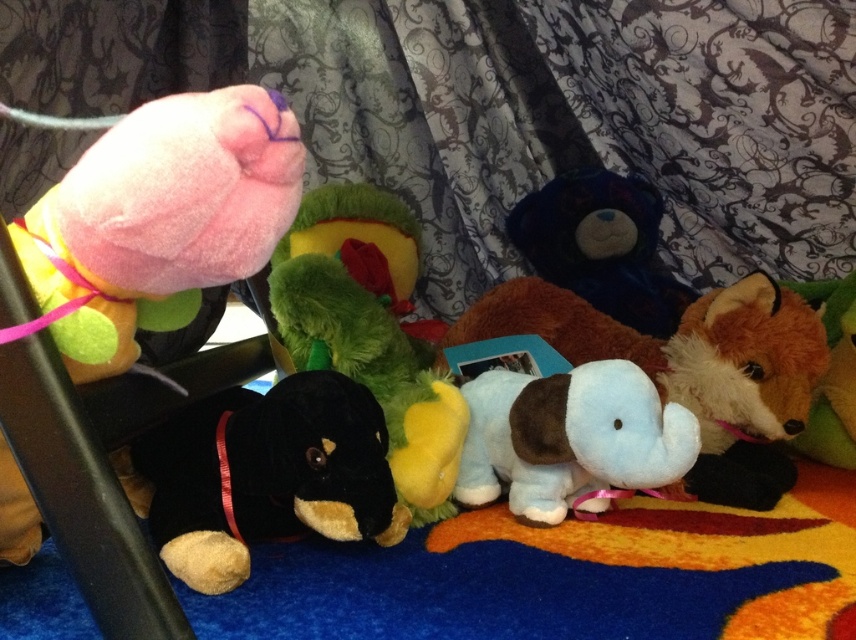
You are organizing a toy store display and need to place a new toy between the pink plush toy at left and the velvety green plush at center. The new toy is 20 centimeters wide. Is there enough space between them to fit the new toy without moving the existing ones?

The distance between the pink plush toy at left and the velvety green plush at center is 42.59 centimeters. Since the new toy is only 20 centimeters wide, there is sufficient space to place it between them without moving the existing toys.

You are a toy organizer who needs to place a new toy that is 1 meter long between the pink plush toy at left and the light blue plush dog at center. Is there enough space between them to fit the new toy?

The distance between the pink plush toy at left and the light blue plush dog at center is 70.28 centimeters. Since the new toy is 1 meter long, which is 30 centimeters longer than the available space, there is not enough room to fit it between them.